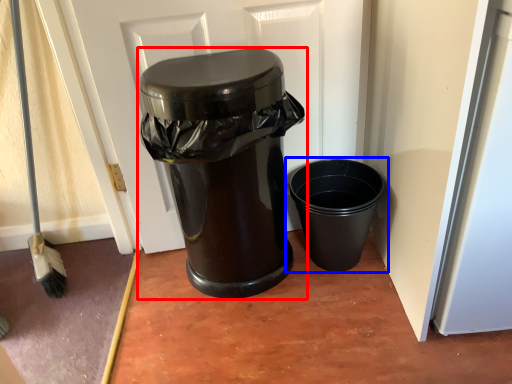
Question: Which object appears farthest to the camera in this image, waste container (highlighted by a red box) or waste container (highlighted by a blue box)?

Choices:
 (A) waste container
 (B) waste container

Answer: (B)